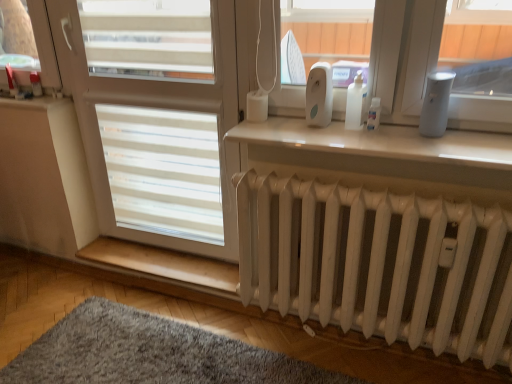
Question: Is white plastic device at upper center facing away from white matte screen door at center?

Choices:
 (A) yes
 (B) no

Answer: (B)

Question: From a real-world perspective, is white plastic device at upper center located beneath white matte screen door at center?

Choices:
 (A) yes
 (B) no

Answer: (B)

Question: Considering the relative sizes of white plastic device at upper center and white matte screen door at center in the image provided, is white plastic device at upper center thinner than white matte screen door at center?

Choices:
 (A) no
 (B) yes

Answer: (B)

Question: From the image's perspective, does white plastic device at upper center appear lower than white matte screen door at center?

Choices:
 (A) no
 (B) yes

Answer: (A)

Question: Does white plastic device at upper center touch white matte screen door at center?

Choices:
 (A) no
 (B) yes

Answer: (A)

Question: Visually, is white plastic device at upper center positioned to the left or to the right of white matte radiator at lower center?

Choices:
 (A) left
 (B) right

Answer: (A)

Question: From the image's perspective, is white plastic device at upper center positioned above or below white matte radiator at lower center?

Choices:
 (A) below
 (B) above

Answer: (B)

Question: Would you say white plastic device at upper center is inside or outside white matte radiator at lower center?

Choices:
 (A) outside
 (B) inside

Answer: (A)

Question: Is white plastic device at upper center wider or thinner than white matte radiator at lower center?

Choices:
 (A) thin
 (B) wide

Answer: (A)

Question: Does point (418, 139) appear closer or farther from the camera than point (262, 223)?

Choices:
 (A) farther
 (B) closer

Answer: (B)

Question: Is white glossy radiator at lower center in front of or behind white matte radiator at lower center in the image?

Choices:
 (A) behind
 (B) front

Answer: (A)

Question: Is white glossy radiator at lower center situated inside white matte radiator at lower center or outside?

Choices:
 (A) outside
 (B) inside

Answer: (A)

Question: From the image's perspective, is white glossy radiator at lower center above or below white matte radiator at lower center?

Choices:
 (A) above
 (B) below

Answer: (A)

Question: In the image, is light brown wood at lower center positioned in front of or behind white matte radiator at lower center?

Choices:
 (A) behind
 (B) front

Answer: (A)

Question: From a real-world perspective, is light brown wood at lower center physically located above or below white matte radiator at lower center?

Choices:
 (A) above
 (B) below

Answer: (B)